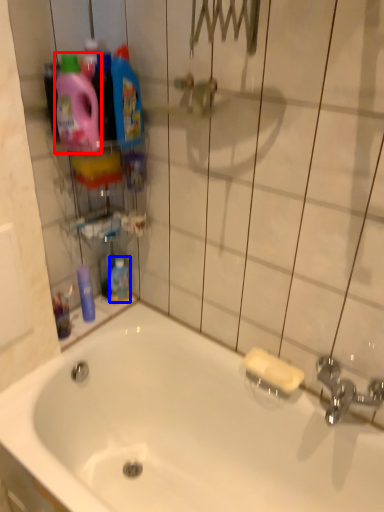
Question: Which of the following is the farthest to the observer, cleaning product (highlighted by a red box) or mouthwash (highlighted by a blue box)?

Choices:
 (A) cleaning product
 (B) mouthwash

Answer: (B)